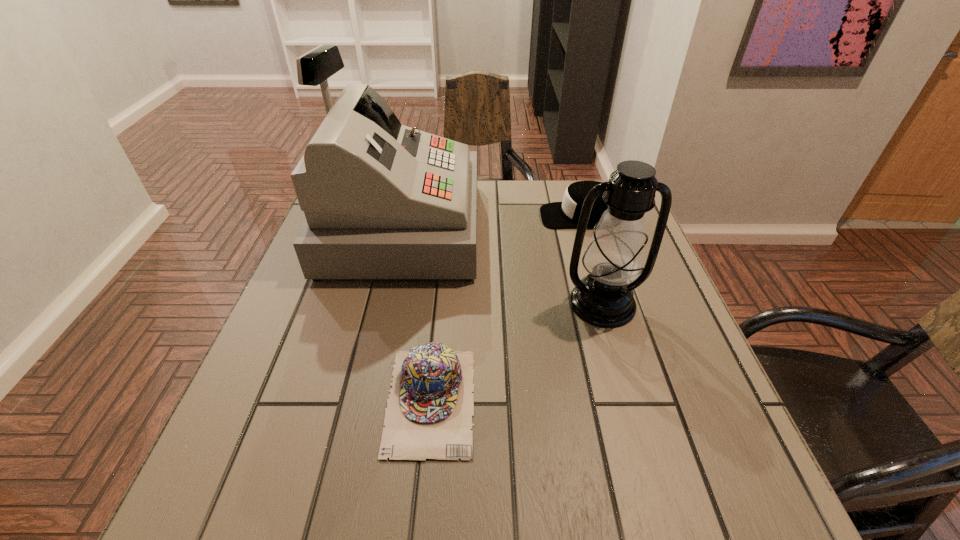
At what (x,y) coordinates should I click in order to perform the action: click on free space at the left edge. Please return your answer as a coordinate pair (x, y). This screenshot has height=540, width=960. Looking at the image, I should click on (276, 353).

In the image, there is a desktop. At what (x,y) coordinates should I click in order to perform the action: click on vacant space at the right edge. Please return your answer as a coordinate pair (x, y). This screenshot has height=540, width=960. Looking at the image, I should click on (675, 335).

In the image, there is a desktop. Identify the location of vacant space at the far right corner. Image resolution: width=960 pixels, height=540 pixels. click(594, 180).

What are the coordinates of `free space at the near right corner` in the screenshot? It's located at (700, 482).

Identify the location of empty space between the cash register and the taller cap. This screenshot has width=960, height=540. (491, 222).

Where is `free space between the second tallest object and the tallest object`? The width and height of the screenshot is (960, 540). free space between the second tallest object and the tallest object is located at coordinates (501, 266).

You are a GUI agent. You are given a task and a screenshot of the screen. Output one action in this format:
    pyautogui.click(x=<x>, y=<y>)
    Task: Click on the unoccupied area between the farther cap and the shortest object
    The height and width of the screenshot is (540, 960).
    Given the screenshot: What is the action you would take?
    pyautogui.click(x=506, y=308)

Locate an element on the screen. blank region between the nearest object and the taller cap is located at coordinates (506, 308).

This screenshot has width=960, height=540. What are the coordinates of `vacant area between the cash register and the shorter cap` in the screenshot? It's located at (416, 314).

Where is `free spot between the oil lamp and the tallest object`? The width and height of the screenshot is (960, 540). free spot between the oil lamp and the tallest object is located at coordinates [501, 266].